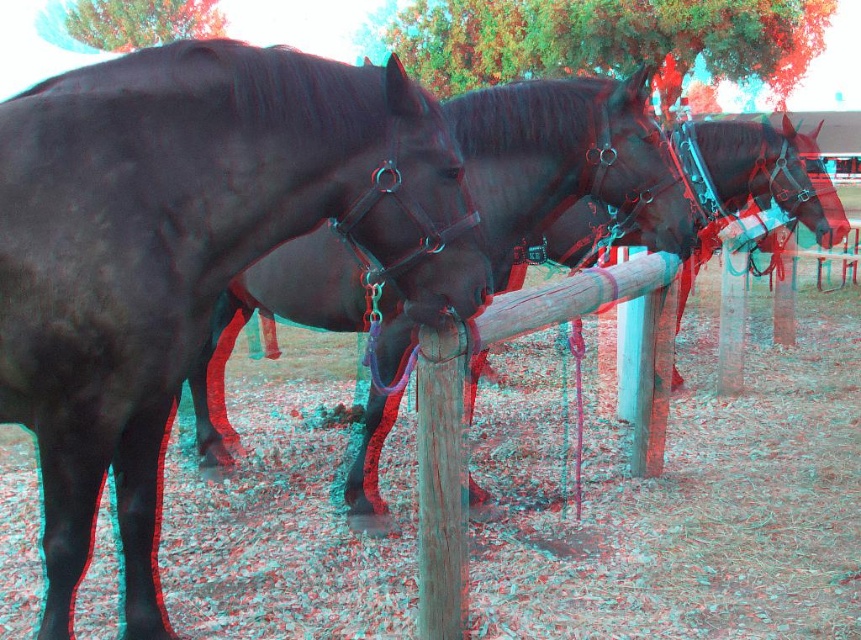
Question: Does shiny black horse at center appear on the left side of wooden post at center?

Choices:
 (A) no
 (B) yes

Answer: (B)

Question: From the image, what is the correct spatial relationship of shiny black horse at center in relation to wooden post at center?

Choices:
 (A) above
 (B) below

Answer: (A)

Question: Which is nearer to the shiny black horse at center?

Choices:
 (A) shiny black horse at left
 (B) wooden post at center

Answer: (B)

Question: Which point appears closest to the camera in this image?

Choices:
 (A) (248, 244)
 (B) (653, 202)

Answer: (A)

Question: Can you confirm if shiny black horse at center is bigger than wooden post at center?

Choices:
 (A) no
 (B) yes

Answer: (B)

Question: Which point is closer to the camera?

Choices:
 (A) shiny black horse at left
 (B) shiny black horse at center
 (C) wooden post at center

Answer: (A)